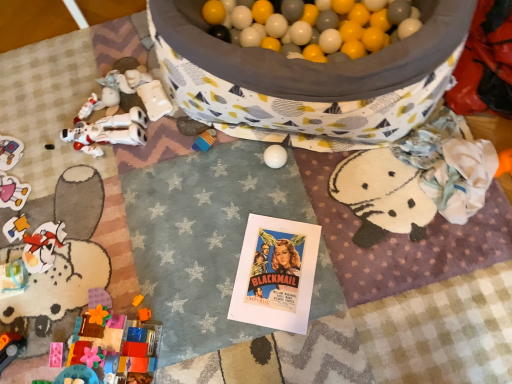
This screenshot has width=512, height=384. What are the coordinates of `vacant space behind plastic toy car at lower left, which is counted as the 2th toy, starting from the top` in the screenshot? It's located at (19, 103).